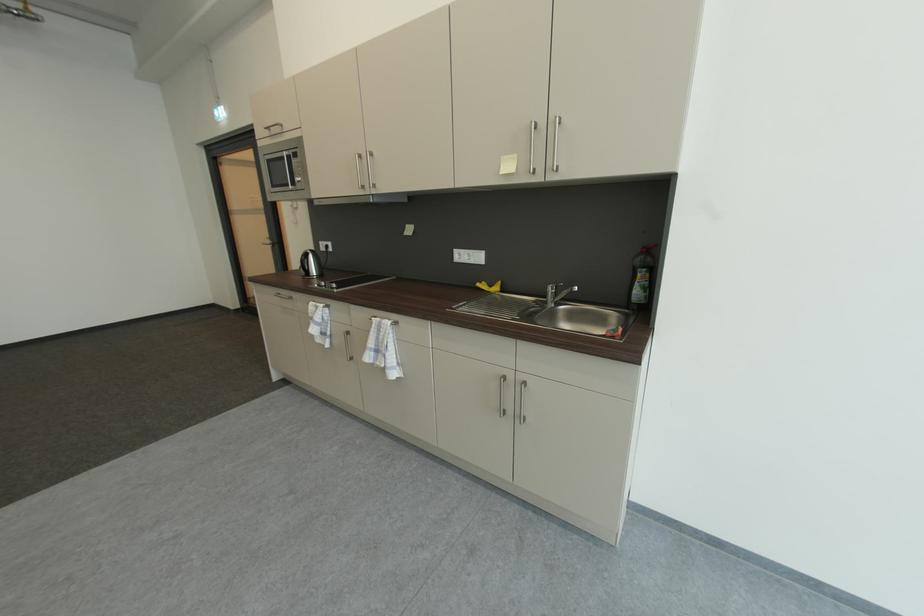
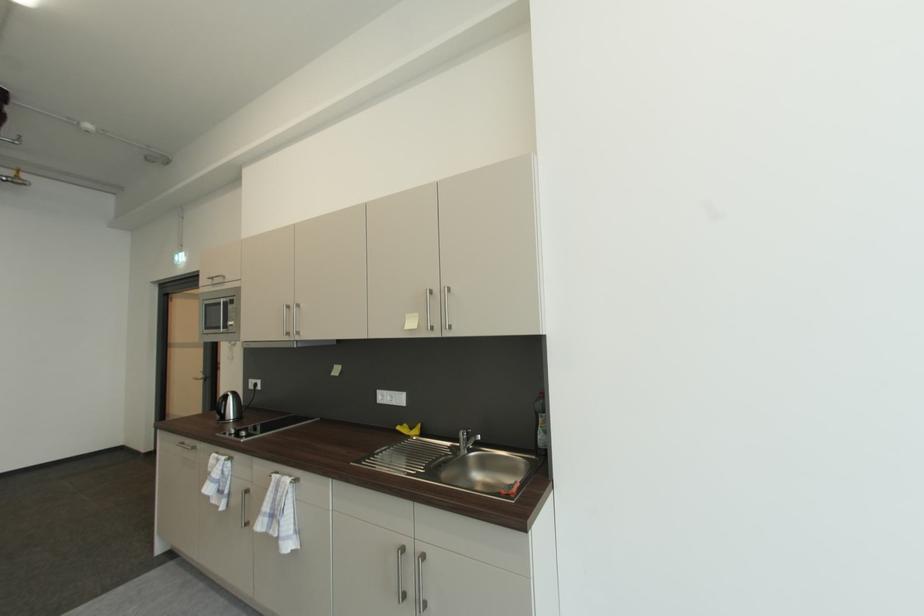
In the second image, find the point that corresponds to pixel 315 315 in the first image.

(215, 471)